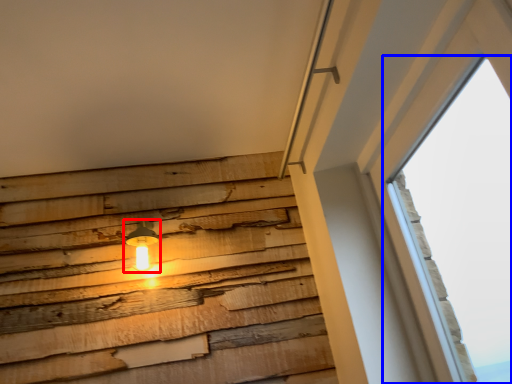
Question: Which point is further to the camera, lamp (highlighted by a red box) or window (highlighted by a blue box)?

Choices:
 (A) lamp
 (B) window

Answer: (A)